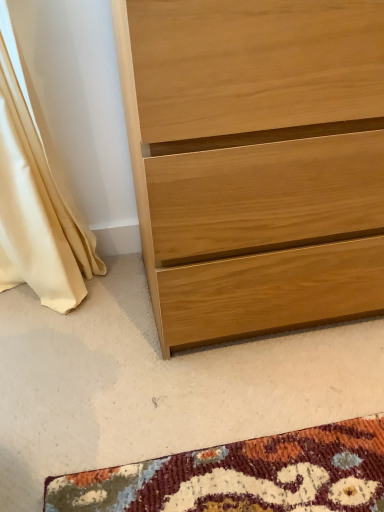
What is the approximate width of light brown wood chest of drawers at lower right?

20.36 inches.

This screenshot has width=384, height=512. Find the location of `light brown wood chest of drawers at lower right`. light brown wood chest of drawers at lower right is located at coordinates (255, 161).

This screenshot has height=512, width=384. Describe the element at coordinates (255, 161) in the screenshot. I see `light brown wood chest of drawers at lower right` at that location.

Where is `light brown wood chest of drawers at lower right`? light brown wood chest of drawers at lower right is located at coordinates (255, 161).